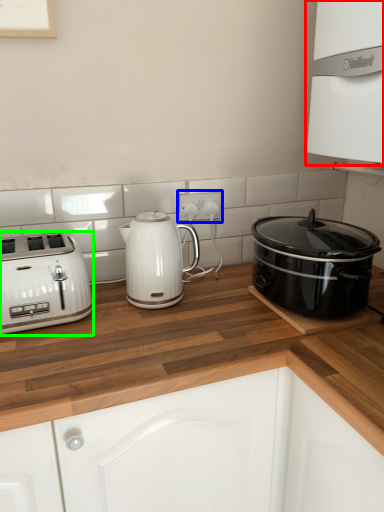
Question: Considering the real-world distances, which object is farthest from oven (highlighted by a red box)? electric outlet (highlighted by a blue box) or toaster (highlighted by a green box)?

Choices:
 (A) electric outlet
 (B) toaster

Answer: (B)